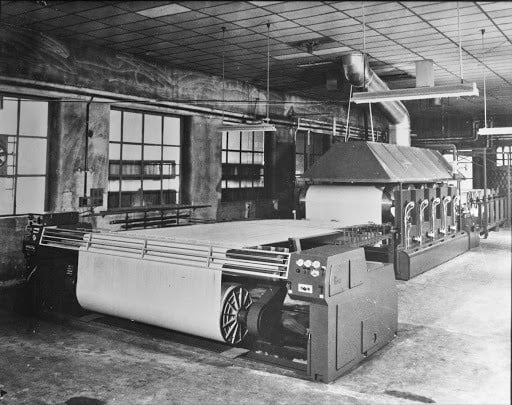
Find the location of a particular element. The image size is (512, 405). control panel part is located at coordinates (300, 264), (305, 261), (314, 263), (315, 275), (295, 270), (300, 286), (318, 293), (302, 269), (325, 270).